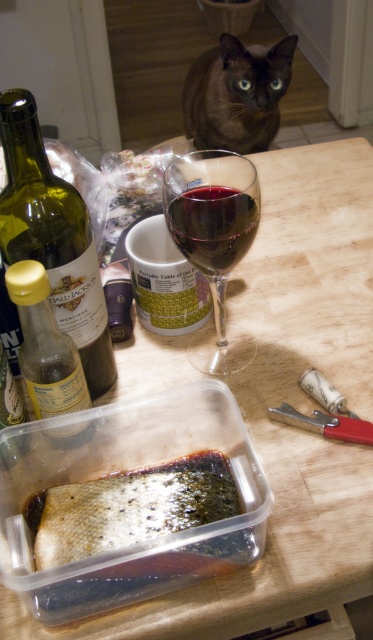
Question: Can you confirm if brown fur cat at upper center is positioned to the left of ruby glass wine at center?

Choices:
 (A) no
 (B) yes

Answer: (A)

Question: Which object appears farthest from the camera in this image?

Choices:
 (A) transparent glass wine glass at center
 (B) brown fur cat at upper center

Answer: (B)

Question: Is green glass bottle at left below translucent yellow glass bottle at center-left?

Choices:
 (A) yes
 (B) no

Answer: (B)

Question: Can you confirm if brown fur cat at upper center is bigger than ruby glass wine at center?

Choices:
 (A) yes
 (B) no

Answer: (A)

Question: Which point appears farthest from the camera in this image?

Choices:
 (A) (24, 241)
 (B) (22, 276)

Answer: (A)

Question: Based on their relative distances, which object is nearer to the ruby glass wine at center?

Choices:
 (A) translucent yellow glass bottle at center-left
 (B) green glass bottle at left
 (C) transparent glass wine glass at center
 (D) translucent plastic fish at center

Answer: (C)